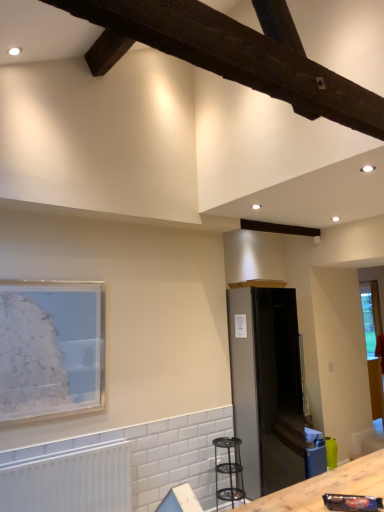
Question: Can you confirm if matte glass picture frame at left is positioned to the right of dark brown wood at upper center?

Choices:
 (A) yes
 (B) no

Answer: (B)

Question: Does matte glass picture frame at left have a larger size compared to dark brown wood at upper center?

Choices:
 (A) yes
 (B) no

Answer: (B)

Question: From the image's perspective, is matte glass picture frame at left beneath dark brown wood at upper center?

Choices:
 (A) no
 (B) yes

Answer: (B)

Question: From a real-world perspective, does matte glass picture frame at left sit lower than dark brown wood at upper center?

Choices:
 (A) no
 (B) yes

Answer: (B)

Question: Does matte glass picture frame at left contain dark brown wood at upper center?

Choices:
 (A) no
 (B) yes

Answer: (A)

Question: From the image's perspective, is metallic black stool at lower center located above or below dark brown wood at upper center?

Choices:
 (A) below
 (B) above

Answer: (A)

Question: Choose the correct answer: Is metallic black stool at lower center inside dark brown wood at upper center or outside it?

Choices:
 (A) outside
 (B) inside

Answer: (A)

Question: Is point (233, 470) closer or farther from the camera than point (269, 36)?

Choices:
 (A) farther
 (B) closer

Answer: (A)

Question: In terms of size, does metallic black stool at lower center appear bigger or smaller than dark brown wood at upper center?

Choices:
 (A) big
 (B) small

Answer: (A)

Question: Is white matte radiator at lower left situated inside dark brown wood at upper center or outside?

Choices:
 (A) outside
 (B) inside

Answer: (A)

Question: From a real-world perspective, relative to dark brown wood at upper center, is white matte radiator at lower left vertically above or below?

Choices:
 (A) above
 (B) below

Answer: (B)

Question: Does point (87, 508) appear closer or farther from the camera than point (296, 97)?

Choices:
 (A) farther
 (B) closer

Answer: (A)

Question: Is white matte radiator at lower left bigger or smaller than dark brown wood at upper center?

Choices:
 (A) small
 (B) big

Answer: (B)

Question: Is matte glass picture frame at left taller or shorter than white matte radiator at lower left?

Choices:
 (A) tall
 (B) short

Answer: (A)

Question: Looking at the image, does matte glass picture frame at left seem bigger or smaller compared to white matte radiator at lower left?

Choices:
 (A) small
 (B) big

Answer: (A)